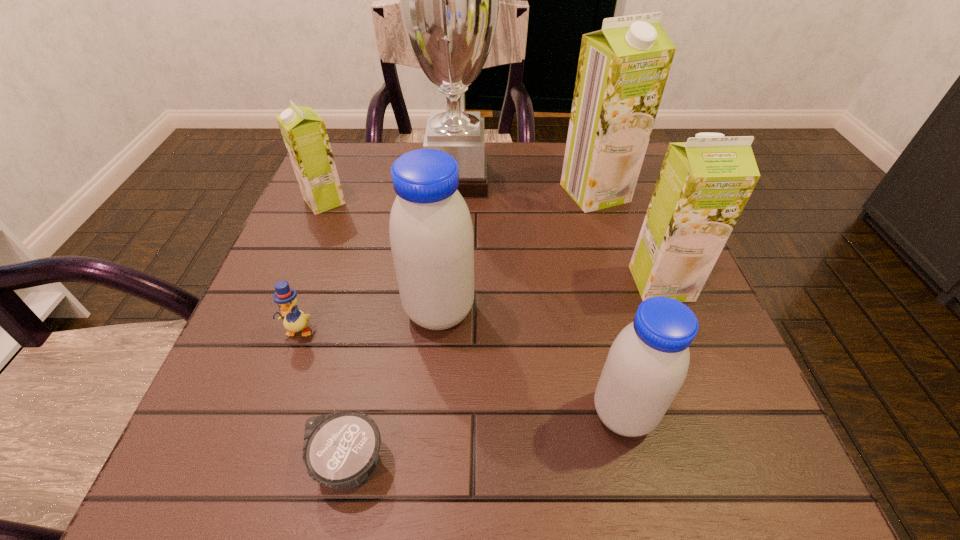
Where is `yellow duckling`? The width and height of the screenshot is (960, 540). yellow duckling is located at coordinates (294, 320).

Identify the location of duckling. (294, 320).

What are the coordinates of `the shortest object` in the screenshot? It's located at (340, 450).

Where is `vacant region located at the front view of the tallest object`? Image resolution: width=960 pixels, height=540 pixels. vacant region located at the front view of the tallest object is located at coordinates (567, 180).

The width and height of the screenshot is (960, 540). Find the location of `vacant area situated 0.200m on the left of the tallest soya milk`. vacant area situated 0.200m on the left of the tallest soya milk is located at coordinates (477, 193).

The height and width of the screenshot is (540, 960). Find the location of `free region located 0.390m on the left of the second biggest green soya milk`. free region located 0.390m on the left of the second biggest green soya milk is located at coordinates (427, 283).

At what (x,y) coordinates should I click in order to perform the action: click on free space located on the left of the farther blue soya milk. Please return your answer as a coordinate pair (x, y). Image resolution: width=960 pixels, height=540 pixels. Looking at the image, I should click on (331, 311).

Locate an element on the screen. The image size is (960, 540). vacant space located on the front of the leftmost green soya milk is located at coordinates (301, 259).

The image size is (960, 540). In order to click on vacant region located on the left of the smaller blue soya milk in this screenshot , I will do `click(557, 414)`.

Locate an element on the screen. free space located on the face of the duckling, where the monocle is placed is located at coordinates (239, 500).